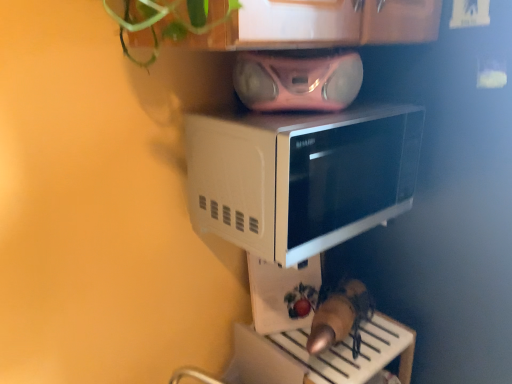
This screenshot has width=512, height=384. What do you see at coordinates (297, 81) in the screenshot?
I see `pink metallic stereo at upper center` at bounding box center [297, 81].

Measure the distance between point [263,296] and camera.

Point [263,296] and camera are 1.11 meters apart.

The image size is (512, 384). What are the coordinates of `white glossy microwave at upper center` in the screenshot? It's located at (x=301, y=177).

I want to click on pink metallic stereo at upper center, so click(297, 81).

From a real-world perspective, which object stands above the other?

pink metallic stereo at upper center.

Considering the relative positions of white glossy microwave at center and pink metallic stereo at upper center in the image provided, is white glossy microwave at center behind pink metallic stereo at upper center?

Yes, white glossy microwave at center is further from the viewer.

Is white glossy microwave at center thinner than pink metallic stereo at upper center?

Indeed, white glossy microwave at center has a lesser width compared to pink metallic stereo at upper center.

Is point (309, 306) positioned after point (287, 61)?

Yes.

Is white glossy microwave at upper center oriented towards pink metallic stereo at upper center?

No, white glossy microwave at upper center does not turn towards pink metallic stereo at upper center.

From the image's perspective, is white glossy microwave at upper center above or below pink metallic stereo at upper center?

Clearly, from the image's perspective, white glossy microwave at upper center is below pink metallic stereo at upper center.

Does white glossy microwave at upper center have a smaller size compared to pink metallic stereo at upper center?

No, white glossy microwave at upper center is not smaller than pink metallic stereo at upper center.

Is white glossy microwave at center located outside white glossy microwave at upper center?

white glossy microwave at center lies outside white glossy microwave at upper center's area.

Considering the positions of objects white glossy microwave at center and white glossy microwave at upper center in the image provided, who is more to the left, white glossy microwave at center or white glossy microwave at upper center?

white glossy microwave at center.

From a real-world perspective, is white glossy microwave at center beneath white glossy microwave at upper center?

Indeed, from a real-world perspective, white glossy microwave at center is positioned beneath white glossy microwave at upper center.

Considering the relative sizes of white glossy microwave at center and white glossy microwave at upper center in the image provided, is white glossy microwave at center taller than white glossy microwave at upper center?

Indeed, white glossy microwave at center has a greater height compared to white glossy microwave at upper center.

From a real-world perspective, is white glossy microwave at upper center on top of white glossy microwave at center?

Yes, from a real-world perspective, white glossy microwave at upper center is over white glossy microwave at center

Is white glossy microwave at upper center taller than white glossy microwave at center?

In fact, white glossy microwave at upper center may be shorter than white glossy microwave at center.

Considering their positions, is white glossy microwave at upper center located in front of or behind white glossy microwave at center?

Clearly, white glossy microwave at upper center is in front of white glossy microwave at center.

From the image's perspective, is pink metallic stereo at upper center under white glossy microwave at center?

No, from the image's perspective, pink metallic stereo at upper center is not below white glossy microwave at center.

From a real-world perspective, is pink metallic stereo at upper center physically located above or below white glossy microwave at center?

pink metallic stereo at upper center is above white glossy microwave at center.

In the image, is pink metallic stereo at upper center on the left side or the right side of white glossy microwave at center?

Clearly, pink metallic stereo at upper center is on the right of white glossy microwave at center in the image.

Does pink metallic stereo at upper center have a greater height compared to white glossy microwave at center?

Incorrect, the height of pink metallic stereo at upper center is not larger of that of white glossy microwave at center.

Would you say pink metallic stereo at upper center contains white glossy microwave at upper center?

Actually, white glossy microwave at upper center is outside pink metallic stereo at upper center.

Would you say pink metallic stereo at upper center is a long distance from white glossy microwave at upper center?

No, pink metallic stereo at upper center is in close proximity to white glossy microwave at upper center.

Considering the sizes of objects pink metallic stereo at upper center and white glossy microwave at upper center in the image provided, who is thinner, pink metallic stereo at upper center or white glossy microwave at upper center?

With smaller width is pink metallic stereo at upper center.

Is the depth of pink metallic stereo at upper center less than that of white glossy microwave at upper center?

No, pink metallic stereo at upper center is further to the viewer.

Where is `appliance located below the pink metallic stereo at upper center (from the image's perspective)`? appliance located below the pink metallic stereo at upper center (from the image's perspective) is located at coordinates (283, 294).

The width and height of the screenshot is (512, 384). I want to click on microwave oven in front of the pink metallic stereo at upper center, so click(301, 177).

Looking at the image, which one is located further to white glossy microwave at center, white glossy microwave at upper center or pink metallic stereo at upper center?

white glossy microwave at upper center is further to white glossy microwave at center.

Estimate the real-world distances between objects in this image. Which object is closer to pink metallic stereo at upper center, white glossy microwave at upper center or white glossy microwave at center?

white glossy microwave at center is closer to pink metallic stereo at upper center.

Estimate the real-world distances between objects in this image. Which object is closer to white glossy microwave at center, pink metallic stereo at upper center or white glossy microwave at upper center?

Based on the image, pink metallic stereo at upper center appears to be nearer to white glossy microwave at center.

Considering their positions, is white glossy microwave at center positioned further to pink metallic stereo at upper center than white glossy microwave at upper center?

white glossy microwave at upper center.

Based on their spatial positions, is pink metallic stereo at upper center or white glossy microwave at center closer to white glossy microwave at upper center?

white glossy microwave at center lies closer to white glossy microwave at upper center than the other object.

Which object lies further to the anchor point white glossy microwave at upper center, white glossy microwave at center or pink metallic stereo at upper center?

Based on the image, pink metallic stereo at upper center appears to be further to white glossy microwave at upper center.

Locate an element on the screen. The width and height of the screenshot is (512, 384). microwave oven that lies between pink metallic stereo at upper center and white glossy microwave at center from top to bottom is located at coordinates (301, 177).